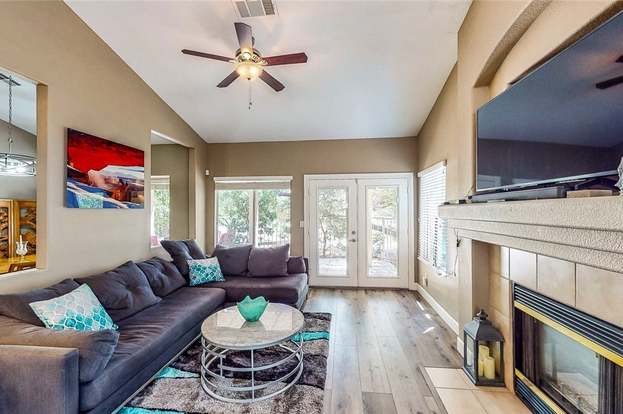
This screenshot has width=623, height=414. In order to click on candles in this screenshot , I will do `click(483, 364)`.